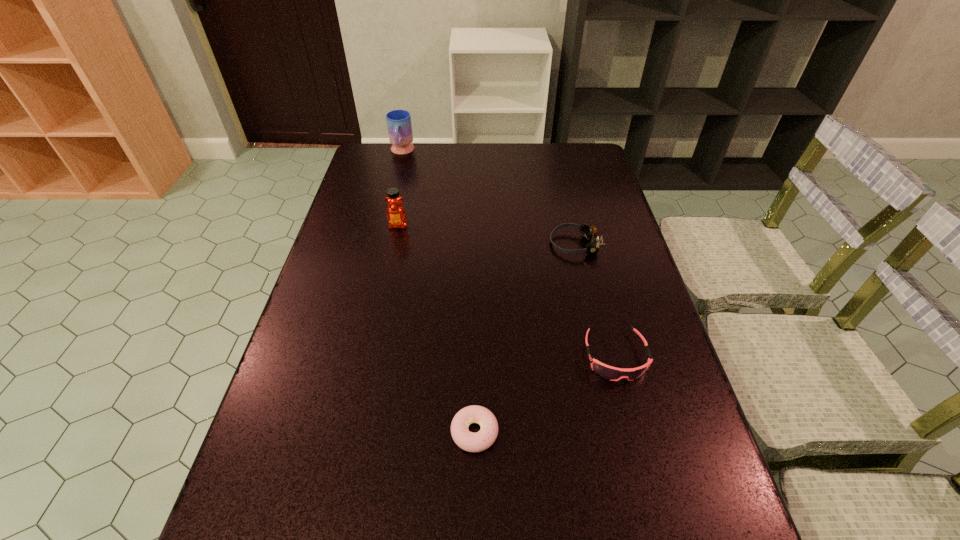
Locate an element on the screen. free space between the honey and the third object from right to left is located at coordinates 437,328.

Where is `the second closest object to the farther goggles`? the second closest object to the farther goggles is located at coordinates (x=396, y=215).

Identify which object is the third nearest to the farthest object. Please provide its 2D coordinates. Your answer should be formatted as a tuple, i.e. [(x, y)], where the tuple contains the x and y coordinates of a point satisfying the conditions above.

[(608, 372)]

Identify the location of vacant space that satisfies the following two spatial constraints: 1. on the front label of the shortest object; 2. on the right side of the honey. The image size is (960, 540). (354, 432).